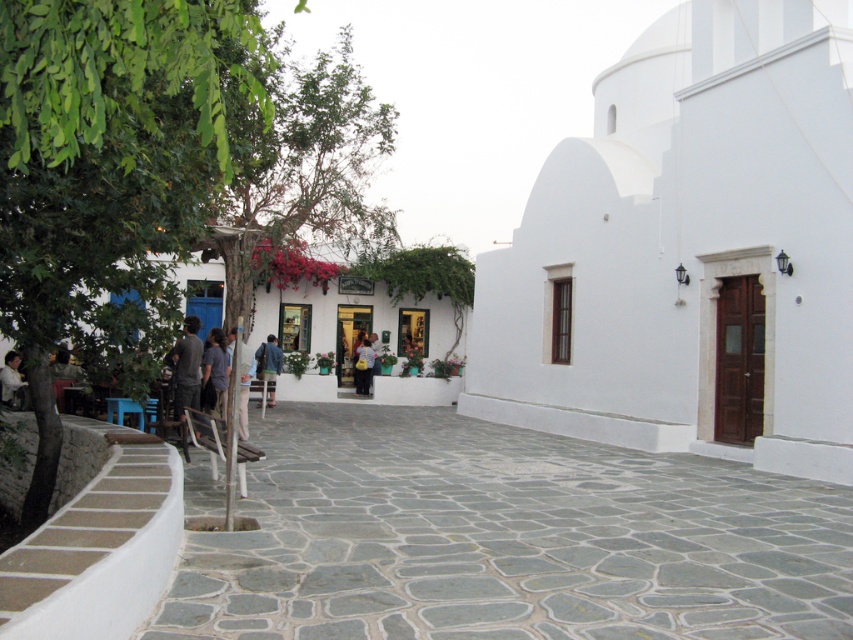
Question: Which object appears closest to the camera in this image?

Choices:
 (A) blue denim jeans at center
 (B) white smooth church at center
 (C) matte black shirt at center

Answer: (A)

Question: Considering the relative positions of dark gray shirt at center and blue denim jacket at center in the image provided, where is dark gray shirt at center located with respect to blue denim jacket at center?

Choices:
 (A) above
 (B) below

Answer: (A)

Question: Is dark gray fabric jacket at center bigger than matte black shirt at center?

Choices:
 (A) no
 (B) yes

Answer: (A)

Question: Which point appears closest to the camera in this image?

Choices:
 (A) pos(364,378)
 (B) pos(173,380)
 (C) pos(241,428)

Answer: (B)

Question: Considering the real-world distances, which object is closest to the white smooth church at center?

Choices:
 (A) gray stone alley at center
 (B) white cotton shirt at lower left

Answer: (A)

Question: Is blue denim jeans at center wider than white cotton shirt at lower left?

Choices:
 (A) no
 (B) yes

Answer: (B)